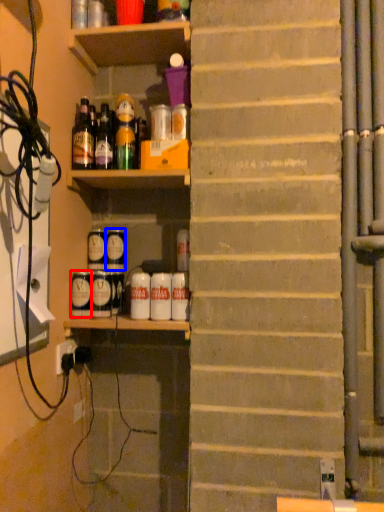
Question: Among these objects, which one is nearest to the camera, beverage (highlighted by a red box) or beverage (highlighted by a blue box)?

Choices:
 (A) beverage
 (B) beverage

Answer: (A)